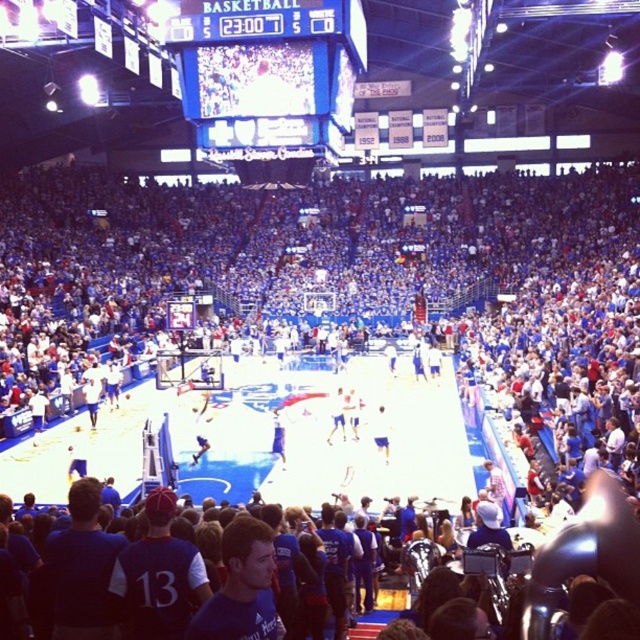
You are a spectator at the basketball game and want to take a photo of the blue fabric shorts at center and the blue glossy scoreboard at upper center. Which object should you point your camera towards first if you want to capture both in a single shot without moving your camera?

You should point your camera towards the blue glossy scoreboard at upper center first because it is located to the left of the blue fabric shorts at center, so capturing it first will ensure both objects are included in the frame without needing to reposition the camera.